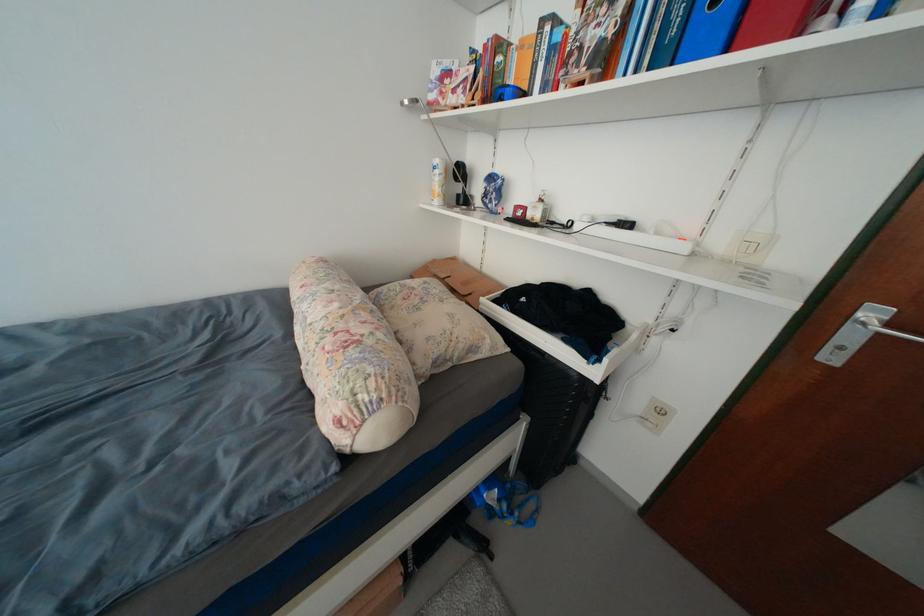
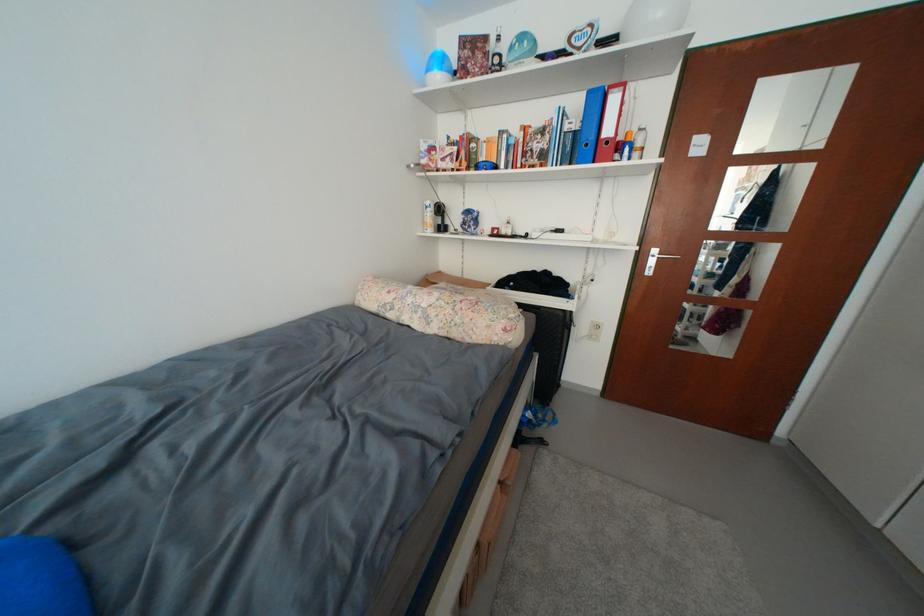
Question: The camera is either moving clockwise (left) or counter-clockwise (right) around the object. The first image is from the beginning of the video and the second image is from the end. Is the camera moving left or right when shooting the video?

Choices:
 (A) Left
 (B) Right

Answer: (A)